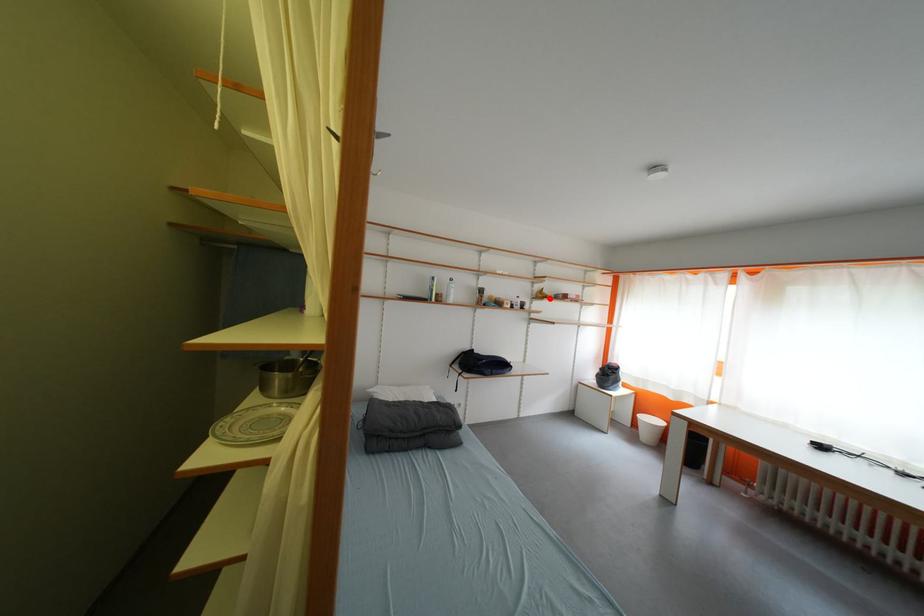
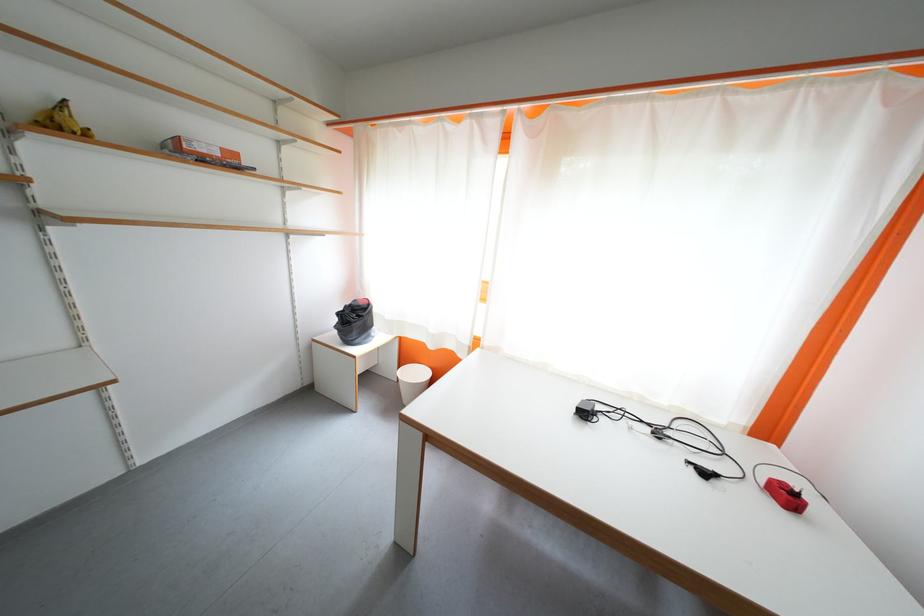
Find the pixel in the second image that matches the highlighted location in the first image.

(68, 129)